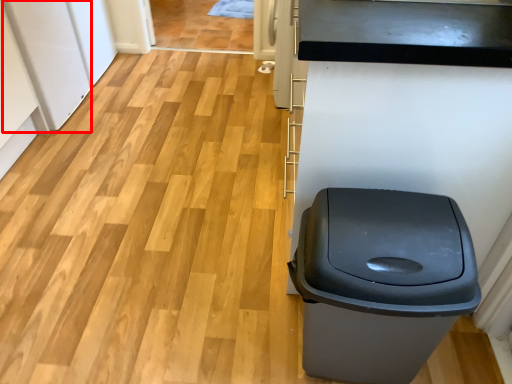
Question: In this image, where is appliance (annotated by the red box) located relative to waste container?

Choices:
 (A) left
 (B) right

Answer: (A)